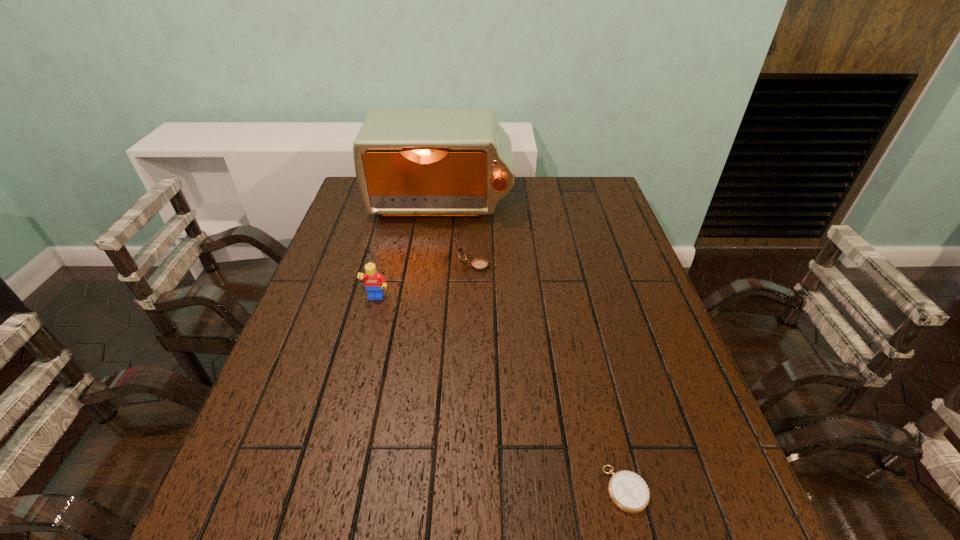
Where is `free space located on the face of the taller compass`? This screenshot has width=960, height=540. free space located on the face of the taller compass is located at coordinates (580, 267).

Identify the location of vacant region located 0.280m on the left of the nearer compass. This screenshot has height=540, width=960. (450, 489).

Identify the location of object situated at the far edge. (458, 162).

Where is `toaster oven at the left edge`? toaster oven at the left edge is located at coordinates (458, 162).

Find the location of a particular element. Image resolution: width=960 pixels, height=540 pixels. Lego at the left edge is located at coordinates (374, 282).

Locate an element on the screen. The image size is (960, 540). object that is at the right edge is located at coordinates (628, 491).

Identify the location of object positioned at the far left corner. This screenshot has height=540, width=960. (458, 162).

This screenshot has width=960, height=540. In the image, there is a desktop. What are the coordinates of `free region at the left edge` in the screenshot? It's located at (285, 435).

Locate an element on the screen. vacant region at the right edge of the desktop is located at coordinates (625, 341).

This screenshot has height=540, width=960. In order to click on vacant region at the far left corner in this screenshot , I will do 355,181.